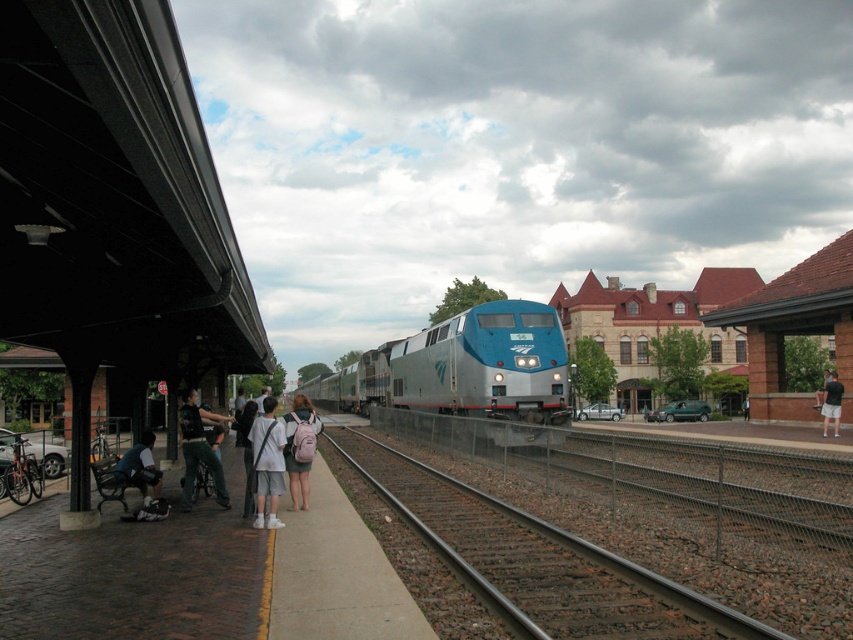
Question: Estimate the real-world distances between objects in this image. Which object is closer to the light gray fabric shorts at center?

Choices:
 (A) black shorts at right
 (B) dark blue jeans at lower left
 (C) smooth steel tracks at center

Answer: (B)

Question: Can you confirm if blue metallic train at center is smaller than black shorts at right?

Choices:
 (A) yes
 (B) no

Answer: (B)

Question: Which point is farther to the camera?

Choices:
 (A) pink fabric backpack at center
 (B) black shorts at right

Answer: (B)

Question: Can you confirm if smooth steel tracks at center is positioned to the left of pink fabric backpack at center?

Choices:
 (A) no
 (B) yes

Answer: (A)

Question: Can you confirm if dark gray backpack at center is smaller than pink fabric backpack at center?

Choices:
 (A) yes
 (B) no

Answer: (B)

Question: Which of the following is the closest to the observer?

Choices:
 (A) (820, 560)
 (B) (265, 449)

Answer: (A)